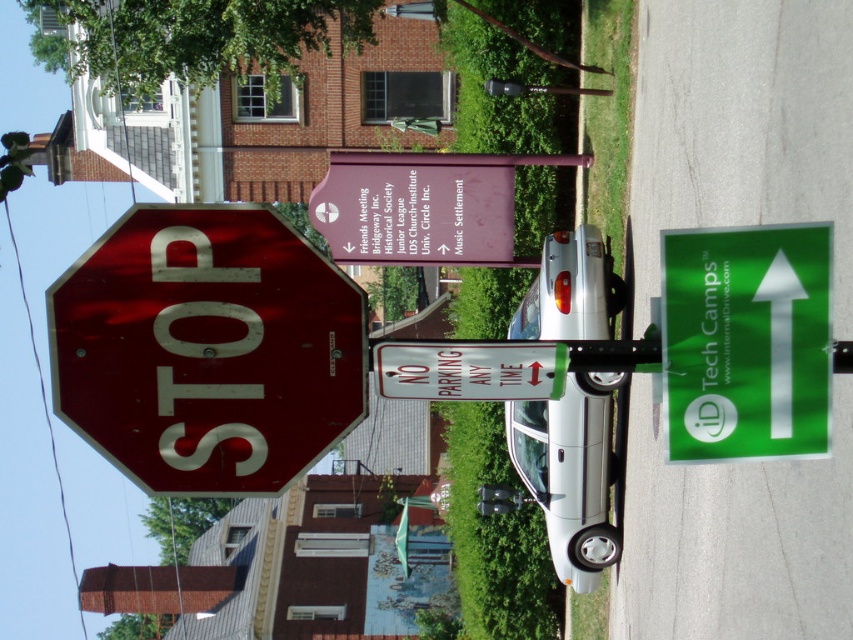
Between shiny red stop sign at left and white plastic sign at center, which one appears on the left side from the viewer's perspective?

shiny red stop sign at left is more to the left.

Does point (148, 292) come farther from viewer compared to point (492, 368)?

No.

Does point (151, 211) lie in front of point (509, 342)?

Yes, it is in front of point (509, 342).

Locate an element on the screen. This screenshot has width=853, height=640. shiny red stop sign at left is located at coordinates (207, 349).

Image resolution: width=853 pixels, height=640 pixels. Describe the element at coordinates (207, 349) in the screenshot. I see `shiny red stop sign at left` at that location.

Between shiny red stop sign at left and green glossy arrow at upper right, which one has less height?

green glossy arrow at upper right

The height and width of the screenshot is (640, 853). Find the location of `shiny red stop sign at left`. shiny red stop sign at left is located at coordinates (207, 349).

Locate an element on the screen. The height and width of the screenshot is (640, 853). shiny red stop sign at left is located at coordinates (207, 349).

In the scene shown: Can you confirm if green glossy arrow at upper right is positioned above white plastic sign at center?

Yes, green glossy arrow at upper right is above white plastic sign at center.

Does green glossy arrow at upper right have a greater height compared to white plastic sign at center?

Indeed, green glossy arrow at upper right has a greater height compared to white plastic sign at center.

Between point (744, 307) and point (432, 396), which one is positioned in front?

Point (432, 396) is in front.

Where is `green glossy arrow at upper right`? green glossy arrow at upper right is located at coordinates (746, 340).